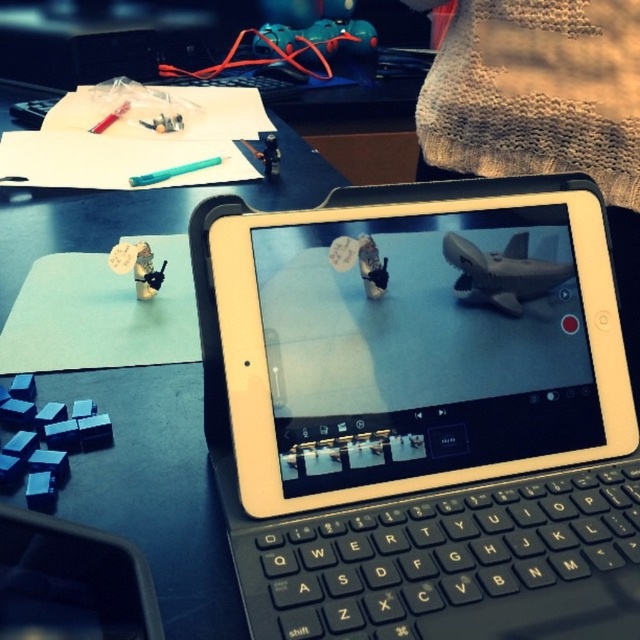
Who is higher up, teal plastic controller at upper center or matte black drone at center?

Positioned higher is teal plastic controller at upper center.

Is point (273, 40) behind point (369, 272)?

Yes, it is behind point (369, 272).

Where is `teal plastic controller at upper center`? The height and width of the screenshot is (640, 640). teal plastic controller at upper center is located at coordinates (314, 42).

Can you confirm if white matte tablet at center is wider than matte plastic toy at center-left?

Yes, white matte tablet at center is wider than matte plastic toy at center-left.

Who is higher up, white matte tablet at center or matte plastic toy at center-left?

matte plastic toy at center-left is above.

From the picture: Who is more forward, (595, 356) or (132, 268)?

Point (595, 356)

What are the coordinates of `white matte tablet at center` in the screenshot? It's located at (422, 413).

Which is more to the right, black plastic blocks at lower left or matte black toy at center?

matte black toy at center

Is point (49, 401) farther from viewer compared to point (269, 170)?

No, (49, 401) is in front of (269, 170).

Describe the element at coordinates (44, 440) in the screenshot. Image resolution: width=640 pixels, height=640 pixels. I see `black plastic blocks at lower left` at that location.

Where is `black plastic blocks at lower left`? Image resolution: width=640 pixels, height=640 pixels. black plastic blocks at lower left is located at coordinates (44, 440).